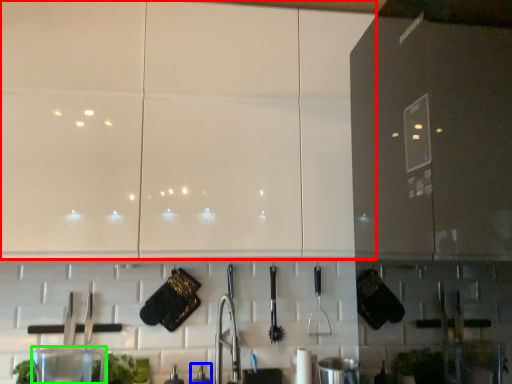
Question: Estimate the real-world distances between objects in this image. Which object is farther from cabinetry (highlighted by a red box), appliance (highlighted by a blue box) or appliance (highlighted by a green box)?

Choices:
 (A) appliance
 (B) appliance

Answer: (A)